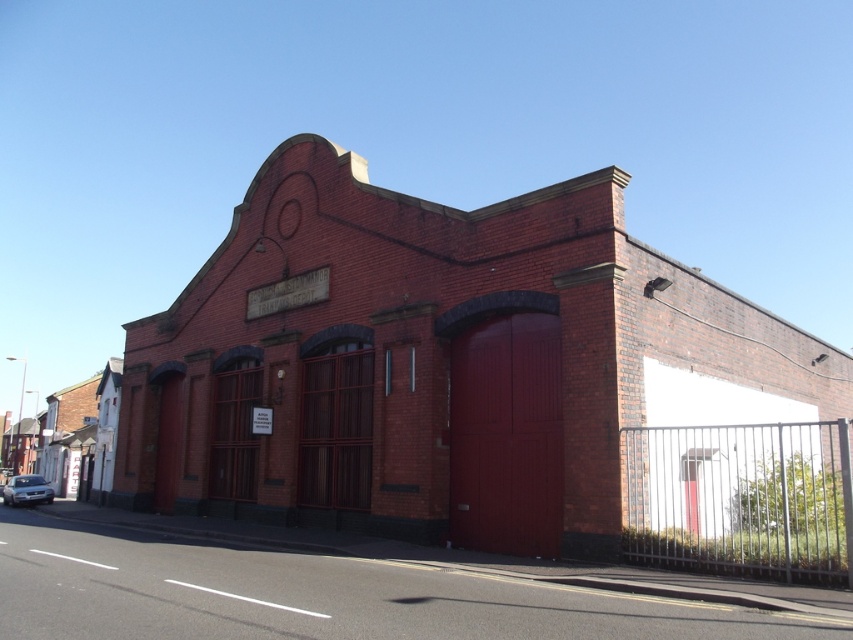
Does brick fire station at center have a lesser height compared to satin silver car at lower left?

In fact, brick fire station at center may be taller than satin silver car at lower left.

Does brick fire station at center have a greater width compared to satin silver car at lower left?

Yes, brick fire station at center is wider than satin silver car at lower left.

The width and height of the screenshot is (853, 640). I want to click on brick fire station at center, so click(x=437, y=362).